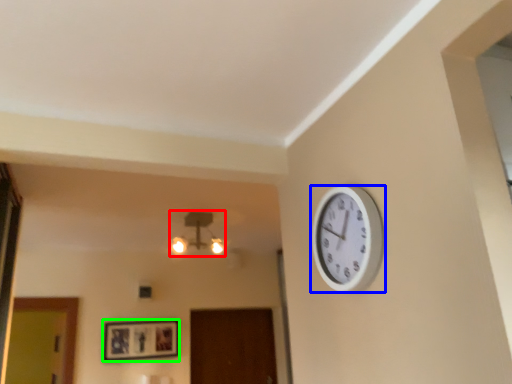
Question: Which object is the closest to the lamp (highlighted by a red box)? Choose among these: wall clock (highlighted by a blue box) or picture frame (highlighted by a green box).

Choices:
 (A) wall clock
 (B) picture frame

Answer: (B)